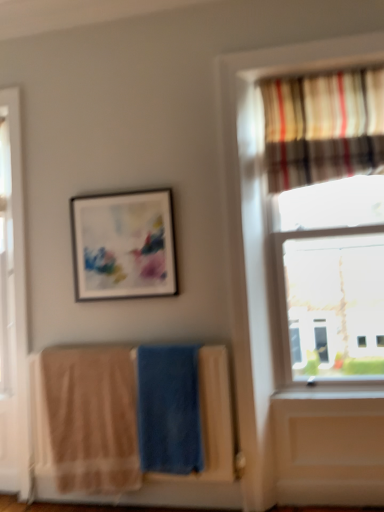
Question: Are striped fabric curtain at upper right and matte black picture frame at upper center located far from each other?

Choices:
 (A) yes
 (B) no

Answer: (B)

Question: Does striped fabric curtain at upper right lie in front of matte black picture frame at upper center?

Choices:
 (A) no
 (B) yes

Answer: (B)

Question: Does striped fabric curtain at upper right have a lesser width compared to matte black picture frame at upper center?

Choices:
 (A) no
 (B) yes

Answer: (A)

Question: Does striped fabric curtain at upper right appear on the right side of matte black picture frame at upper center?

Choices:
 (A) yes
 (B) no

Answer: (A)

Question: Does striped fabric curtain at upper right come behind matte black picture frame at upper center?

Choices:
 (A) yes
 (B) no

Answer: (B)

Question: Is matte black picture frame at upper center surrounded by striped fabric curtain at upper right?

Choices:
 (A) no
 (B) yes

Answer: (A)

Question: Is beige cotton beach towel at lower left, which is the second beach towel from right to left, at the left side of striped fabric curtain at upper right?

Choices:
 (A) no
 (B) yes

Answer: (B)

Question: Is beige cotton beach towel at lower left, which is the second beach towel from right to left, placed right next to striped fabric curtain at upper right?

Choices:
 (A) yes
 (B) no

Answer: (B)

Question: Does beige cotton beach towel at lower left, acting as the 1th beach towel starting from the left, turn towards striped fabric curtain at upper right?

Choices:
 (A) yes
 (B) no

Answer: (B)

Question: Is striped fabric curtain at upper right surrounded by beige cotton beach towel at lower left, acting as the 1th beach towel starting from the left?

Choices:
 (A) yes
 (B) no

Answer: (B)

Question: From a real-world perspective, does beige cotton beach towel at lower left, acting as the 1th beach towel starting from the left, sit lower than striped fabric curtain at upper right?

Choices:
 (A) yes
 (B) no

Answer: (A)

Question: From the image's perspective, is beige cotton beach towel at lower left, which is the second beach towel from right to left, on top of striped fabric curtain at upper right?

Choices:
 (A) no
 (B) yes

Answer: (A)

Question: From a real-world perspective, is beige cotton beach towel at lower left, acting as the 1th beach towel starting from the left, positioned over matte black picture frame at upper center based on gravity?

Choices:
 (A) no
 (B) yes

Answer: (A)